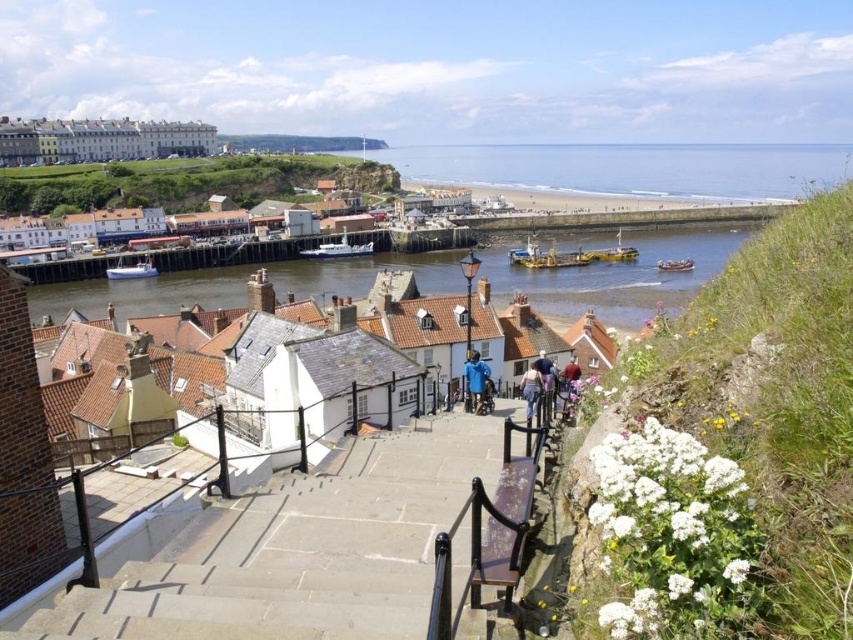
The height and width of the screenshot is (640, 853). Find the location of `blue fabric jacket at center`. blue fabric jacket at center is located at coordinates (474, 380).

Is blue fabric jacket at center above white plastic boat at lower left?

Incorrect, blue fabric jacket at center is not positioned above white plastic boat at lower left.

This screenshot has height=640, width=853. Describe the element at coordinates (474, 380) in the screenshot. I see `blue fabric jacket at center` at that location.

Locate an element on the screen. The height and width of the screenshot is (640, 853). blue fabric jacket at center is located at coordinates (474, 380).

Between white matte boat at center and light brown leather jacket at center, which one has less height?

light brown leather jacket at center

Does white matte boat at center appear on the right side of light brown leather jacket at center?

In fact, white matte boat at center is to the left of light brown leather jacket at center.

The height and width of the screenshot is (640, 853). Identify the location of white matte boat at center. (338, 250).

I want to click on white matte boat at center, so click(x=338, y=250).

Which is more to the left, white matte boat at center or white plastic boat at lower left?

From the viewer's perspective, white plastic boat at lower left appears more on the left side.

Is white matte boat at center positioned at the back of white plastic boat at lower left?

Yes, it is.

This screenshot has width=853, height=640. What are the coordinates of `white matte boat at center` in the screenshot? It's located at (338, 250).